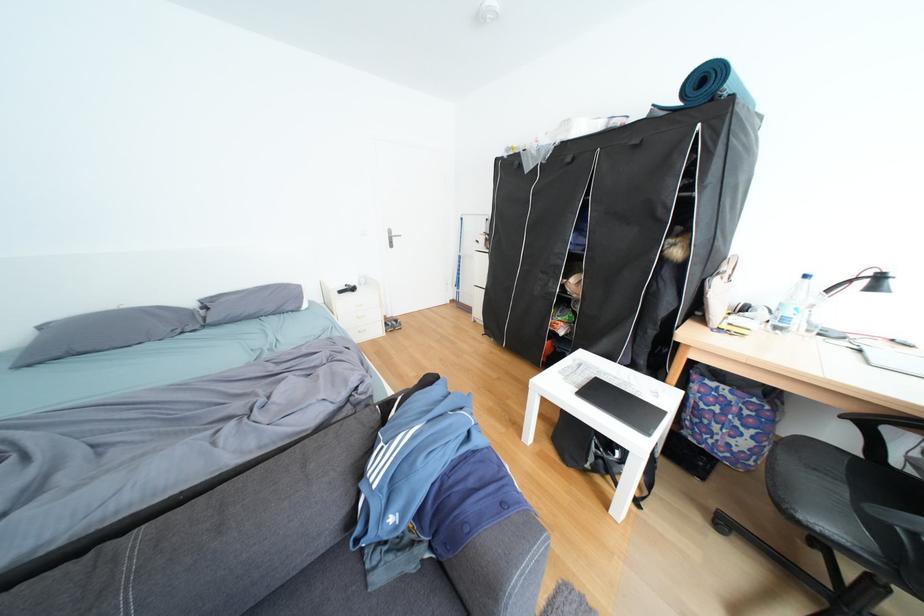
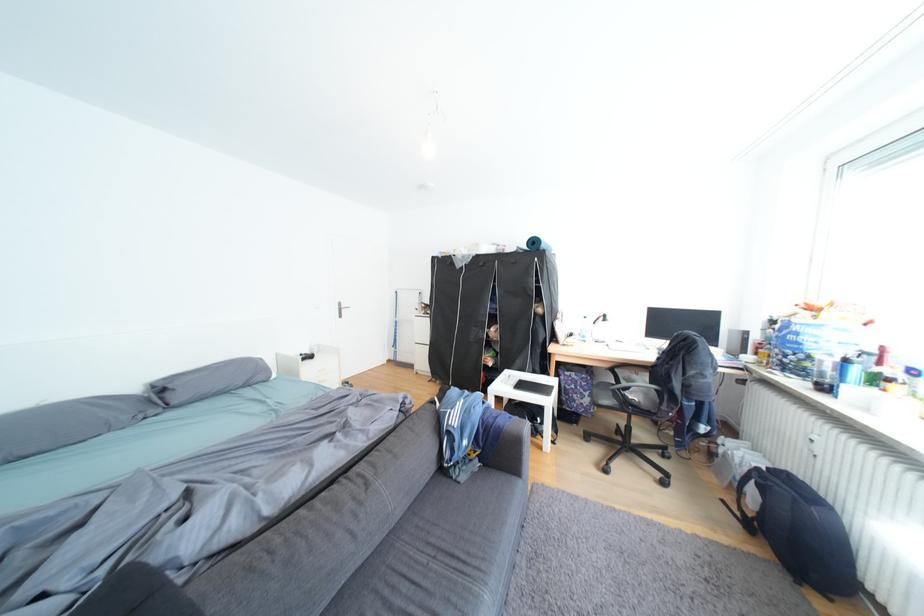
Find the pixel in the second image that matches point (225, 298) in the first image.

(177, 379)